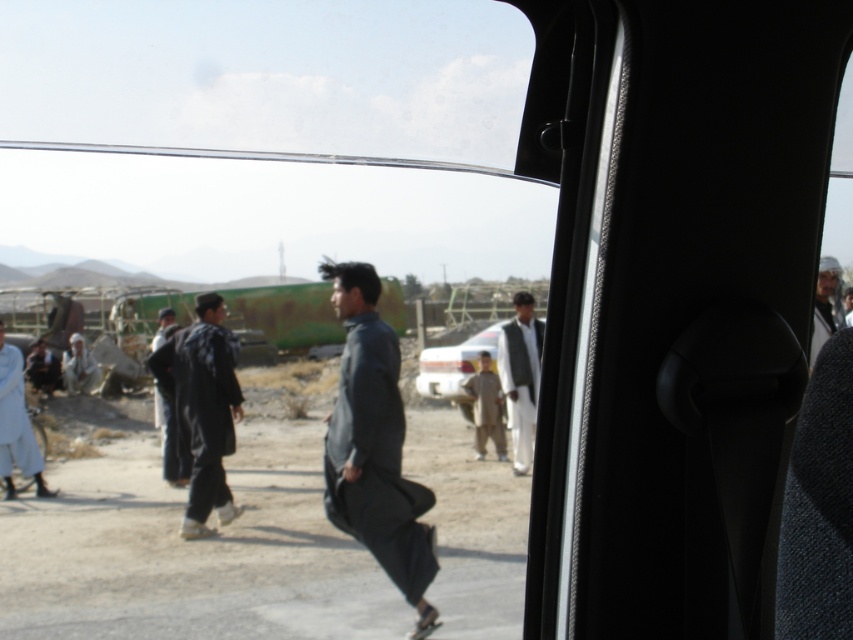
What is the exact location of the dark gray fabric coat at center in the image?

The dark gray fabric coat at center is located at point [202,408].

You are inside a car and looking out through the open window. You see a dark gray fabric at center represented by point (374,445). Is the dark gray fabric at center closer to the car or farther away compared to the people walking on the dirt road?

The dark gray fabric at center represented by point (374,445) is closer to the car than the people walking on the dirt road because it is positioned in the foreground of the scene.

You are a driver who needs to assess the visibility of pedestrians outside your vehicle. Based on the scene, which object is more prominent in your view between the light brown fabric child at center and the dark gray fabric headscarf at upper right?

The light brown fabric child at center is larger in size than the dark gray fabric headscarf at upper right, making it more prominent in the driver s view.